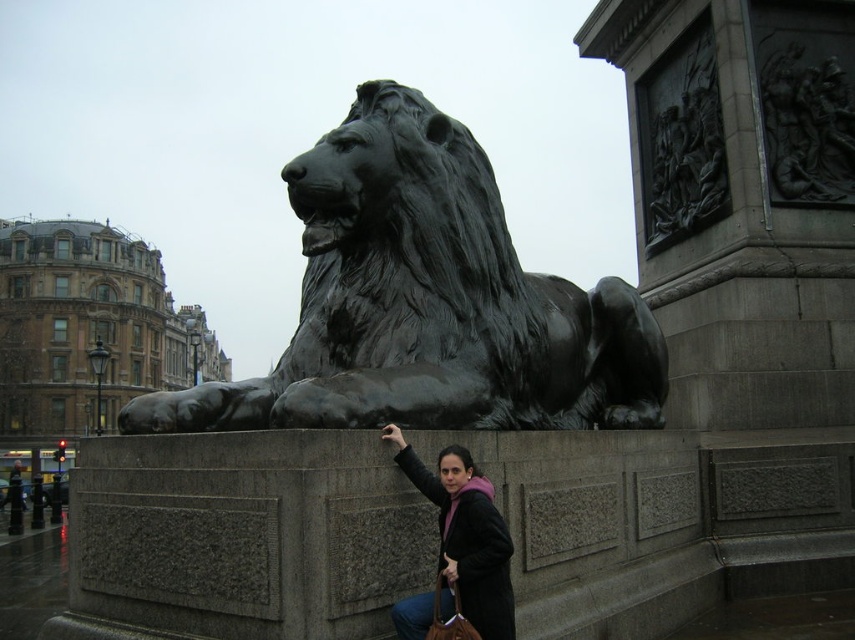
Question: Which point appears farthest from the camera in this image?

Choices:
 (A) (449, 524)
 (B) (196, 413)

Answer: (B)

Question: Which object appears closest to the camera in this image?

Choices:
 (A) matte black jacket at lower center
 (B) black polished stone lion at center

Answer: (A)

Question: Can you confirm if black polished stone lion at center is positioned above matte black jacket at lower center?

Choices:
 (A) yes
 (B) no

Answer: (B)

Question: Does black polished stone lion at center have a greater width compared to matte black jacket at lower center?

Choices:
 (A) no
 (B) yes

Answer: (B)

Question: Does black polished stone lion at center lie behind matte black jacket at lower center?

Choices:
 (A) no
 (B) yes

Answer: (B)